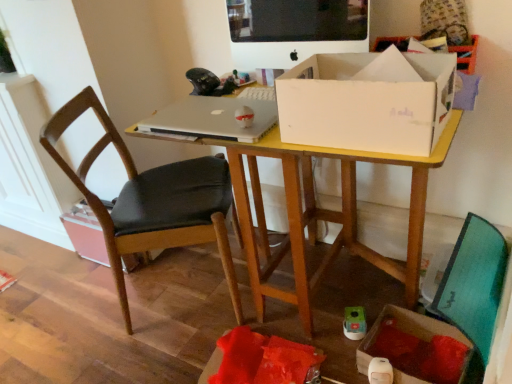
This screenshot has height=384, width=512. I want to click on silver metallic laptop at center, so 213,119.

In order to face cardboard box at lower right, placed as the 1th cardboard box when sorted from front to back, should I rotate leftwards or rightwards?

Turn right by 20.558 degrees to look at cardboard box at lower right, placed as the 1th cardboard box when sorted from front to back.

This screenshot has width=512, height=384. In order to click on black leather chair at left in this screenshot , I will do `click(152, 201)`.

Relative to silver metallic laptop at center, is yellow wood desk at center in front or behind?

yellow wood desk at center is positioned closer to the viewer than silver metallic laptop at center.

Can you confirm if yellow wood desk at center is taller than silver metallic laptop at center?

Yes.

Is yellow wood desk at center oriented towards silver metallic laptop at center?

No, yellow wood desk at center is not oriented towards silver metallic laptop at center.

Identify the location of desk directly beneath the silver metallic laptop at center (from a real-world perspective). (323, 214).

Can you see black leather chair at left, which is the 2th cardboard box from front to back, touching white cardboard box at center?

No, black leather chair at left, which is the 2th cardboard box from front to back, is not with white cardboard box at center.

Is black leather chair at left, the 1th cardboard box when ordered from left to right, inside the boundaries of white cardboard box at center, or outside?

black leather chair at left, the 1th cardboard box when ordered from left to right, is not inside white cardboard box at center, it's outside.

Looking at this image, considering the positions of objects black leather chair at left, which appears as the 2th cardboard box when ordered from the bottom, and white cardboard box at center in the image provided, who is in front, black leather chair at left, which appears as the 2th cardboard box when ordered from the bottom, or white cardboard box at center?

white cardboard box at center is in front.

From the image's perspective, is black leather chair at left, which is counted as the 1th cardboard box, starting from the back, above or below white cardboard box at center?

black leather chair at left, which is counted as the 1th cardboard box, starting from the back, is below white cardboard box at center.

Is silver metallic laptop at center not close to white cardboard box at center?

No, silver metallic laptop at center is in close proximity to white cardboard box at center.

From the image's perspective, is silver metallic laptop at center located above or below white cardboard box at center?

Based on their image positions, silver metallic laptop at center is located above white cardboard box at center.

Identify the location of box located on the right of silver metallic laptop at center. This screenshot has width=512, height=384. (368, 101).

How different are the orientations of silver metallic laptop at center and white cardboard box at center in degrees?

There is a 0.000249-degree angle between the facing directions of silver metallic laptop at center and white cardboard box at center.

Does black leather chair at left appear on the right side of matte black monitor at upper center?

No.

Can you confirm if black leather chair at left is bigger than matte black monitor at upper center?

Yes.

How many degrees apart are the facing directions of black leather chair at left and matte black monitor at upper center?

The angle between the facing direction of black leather chair at left and the facing direction of matte black monitor at upper center is 121 degrees.

Does point (76, 100) appear closer or farther from the camera than point (293, 20)?

Clearly, point (76, 100) is more distant from the camera than point (293, 20).

Can white cardboard box at center be found inside matte black monitor at upper center?

Definitely not — white cardboard box at center is not inside matte black monitor at upper center.

From the image's perspective, is matte black monitor at upper center positioned above or below white cardboard box at center?

From the image's perspective, matte black monitor at upper center appears above white cardboard box at center.

Is matte black monitor at upper center oriented towards white cardboard box at center?

Yes, matte black monitor at upper center is aimed at white cardboard box at center.

In terms of size, does matte black monitor at upper center appear bigger or smaller than white cardboard box at center?

Considering their sizes, matte black monitor at upper center takes up less space than white cardboard box at center.

What are the coordinates of `laptop above the yellow wood desk at center (from a real-world perspective)` in the screenshot? It's located at (213, 119).

Does silver metallic laptop at center have a lesser height compared to yellow wood desk at center?

Yes, silver metallic laptop at center is shorter than yellow wood desk at center.

Between silver metallic laptop at center and yellow wood desk at center, which one is positioned in front?

yellow wood desk at center is more forward.

From a real-world perspective, is silver metallic laptop at center physically located above or below yellow wood desk at center?

silver metallic laptop at center is above yellow wood desk at center.

Is cardboard box at lower right, placed as the 1th cardboard box when sorted from front to back, to the left or to the right of silver metallic laptop at center in the image?

From the image, it's evident that cardboard box at lower right, placed as the 1th cardboard box when sorted from front to back, is to the right of silver metallic laptop at center.

Who is bigger, cardboard box at lower right, the 2th cardboard box positioned from the back, or silver metallic laptop at center?

cardboard box at lower right, the 2th cardboard box positioned from the back, is bigger.

Is cardboard box at lower right, the 2th cardboard box when ordered from left to right, thinner than silver metallic laptop at center?

No, cardboard box at lower right, the 2th cardboard box when ordered from left to right, is not thinner than silver metallic laptop at center.

Is cardboard box at lower right, the 2th cardboard box positioned from the back, positioned before silver metallic laptop at center?

No.

Locate an element on the screen. The height and width of the screenshot is (384, 512). desk lying on the right of silver metallic laptop at center is located at coordinates (323, 214).

From the image's perspective, starting from the white cardboard box at center, which cardboard box is the 1st one below? Please provide its 2D coordinates.

[(85, 233)]

Based on the photo, which object lies nearer to the anchor point silver metallic laptop at center, black leather chair at left or black leather chair at left, which is the 2th cardboard box from front to back?

Based on the image, black leather chair at left appears to be nearer to silver metallic laptop at center.

Considering their positions, is black leather chair at left, which is counted as the 1th cardboard box, starting from the back, positioned closer to white cardboard box at center than silver metallic laptop at center?

Among the two, silver metallic laptop at center is located nearer to white cardboard box at center.

Looking at the image, which one is located closer to yellow wood desk at center, silver metallic laptop at center or black leather chair at left?

The object closer to yellow wood desk at center is black leather chair at left.

Based on their spatial positions, is yellow wood desk at center or matte black monitor at upper center further from white cardboard box at center?

matte black monitor at upper center lies further to white cardboard box at center than the other object.

Looking at the image, which one is located further to black leather chair at left, which is counted as the 1th cardboard box, starting from the back, yellow wood desk at center or white cardboard box at center?

The object further to black leather chair at left, which is counted as the 1th cardboard box, starting from the back, is white cardboard box at center.

Considering their positions, is black leather chair at left, which appears as the 2th cardboard box when ordered from the bottom, positioned further to cardboard box at lower right, the 1th cardboard box positioned from the right, than yellow wood desk at center?

The object further to cardboard box at lower right, the 1th cardboard box positioned from the right, is black leather chair at left, which appears as the 2th cardboard box when ordered from the bottom.

Considering their positions, is yellow wood desk at center positioned further to black leather chair at left than white cardboard box at center?

Among the two, white cardboard box at center is located further to black leather chair at left.

Looking at this image, based on their spatial positions, is cardboard box at lower right, the 2th cardboard box when ordered from left to right, or silver metallic laptop at center closer to white cardboard box at center?

silver metallic laptop at center.

Image resolution: width=512 pixels, height=384 pixels. I want to click on laptop between black leather chair at left and yellow wood desk at center from left to right, so click(213, 119).

Locate an element on the screen. chair positioned between silver metallic laptop at center and black leather chair at left, which appears as the 2th cardboard box when ordered from the bottom, from near to far is located at coordinates (152, 201).

The image size is (512, 384). What are the coordinates of `laptop between black leather chair at left, which is the 2th cardboard box from front to back, and matte black monitor at upper center` in the screenshot? It's located at (213, 119).

Identify the location of desk located between black leather chair at left and white cardboard box at center in the left-right direction. The width and height of the screenshot is (512, 384). (323, 214).